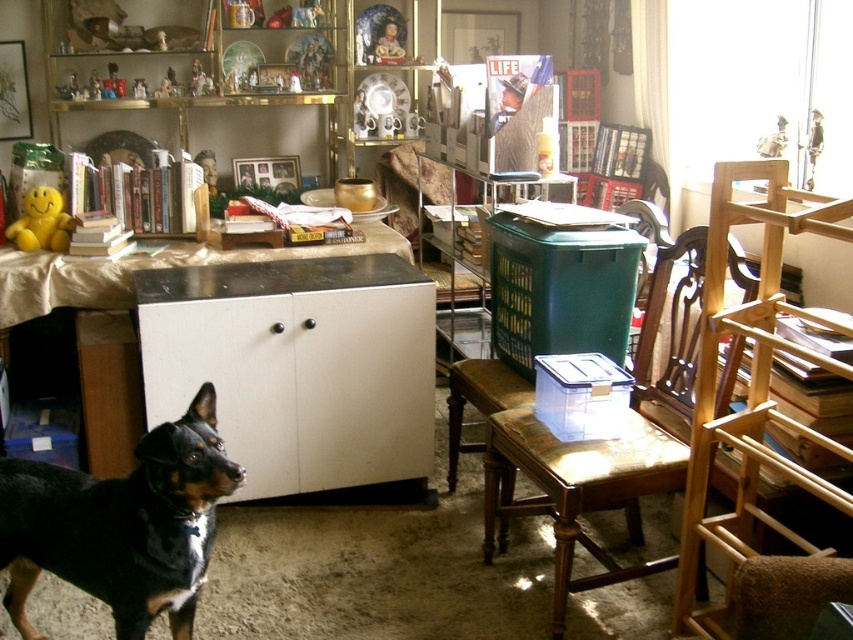
Is white glossy cabinet at center bigger than wooden chair at right?

Yes.

Between point (22, 257) and point (769, 360), which one is positioned behind?

Point (22, 257)

What do you see at coordinates (265, 355) in the screenshot? This screenshot has width=853, height=640. I see `white glossy cabinet at center` at bounding box center [265, 355].

At what (x,y) coordinates should I click in order to perform the action: click on white glossy cabinet at center. Please return your answer as a coordinate pair (x, y). Image resolution: width=853 pixels, height=640 pixels. Looking at the image, I should click on (265, 355).

Does point (412, 305) come farther from viewer compared to point (85, 474)?

Yes, it is.

Image resolution: width=853 pixels, height=640 pixels. In order to click on white glossy cabinet at center in this screenshot , I will do `click(265, 355)`.

The width and height of the screenshot is (853, 640). Identify the location of white glossy cabinet at center. (265, 355).

Is white glossy cabinet at center wider than matte gold frame at upper center?

Yes.

Who is taller, white glossy cabinet at center or matte gold frame at upper center?

white glossy cabinet at center is taller.

Is point (376, 355) positioned behind point (393, 54)?

No.

Where is `white glossy cabinet at center`? white glossy cabinet at center is located at coordinates (265, 355).